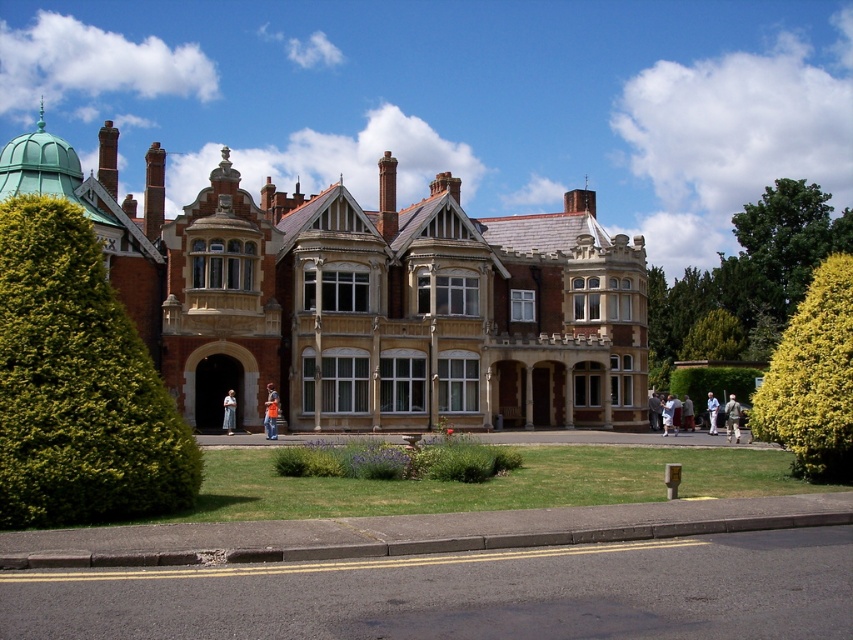
Who is positioned more to the left, green leafy bush at left or green leafy tree at right?

green leafy bush at left is more to the left.

Does green leafy bush at left appear on the right side of green leafy tree at right?

In fact, green leafy bush at left is to the left of green leafy tree at right.

Describe the element at coordinates (77, 384) in the screenshot. This screenshot has height=640, width=853. I see `green leafy bush at left` at that location.

The height and width of the screenshot is (640, 853). Identify the location of green leafy bush at left. (77, 384).

Is green leafy bush at right thinner than light brown leather jacket at center?

No.

Where is `green leafy bush at right`? The width and height of the screenshot is (853, 640). green leafy bush at right is located at coordinates (712, 337).

Does point (834, 465) lie in front of point (738, 428)?

Yes, point (834, 465) is in front of point (738, 428).

Does yellow-green leafy hedge at right lie behind light brown leather jacket at lower right?

No, yellow-green leafy hedge at right is in front of light brown leather jacket at lower right.

Describe the element at coordinates (813, 380) in the screenshot. The width and height of the screenshot is (853, 640). I see `yellow-green leafy hedge at right` at that location.

Where is `yellow-green leafy hedge at right`? This screenshot has height=640, width=853. yellow-green leafy hedge at right is located at coordinates (813, 380).